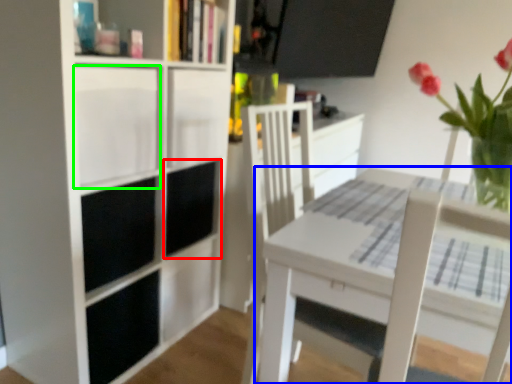
Question: Considering the real-world distances, which object is farthest from cabinet (highlighted by a red box)? table (highlighted by a blue box) or cabinet (highlighted by a green box)?

Choices:
 (A) table
 (B) cabinet

Answer: (A)